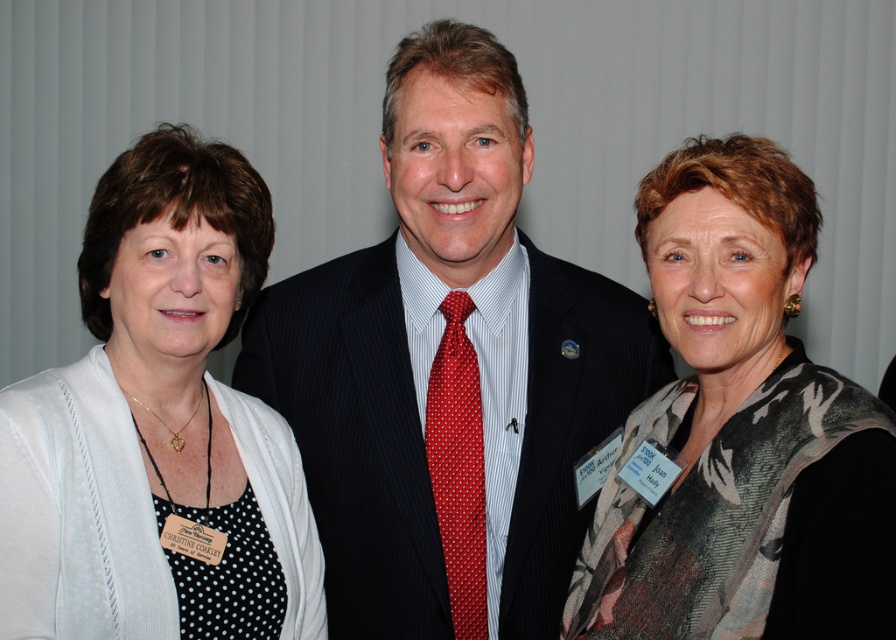
The height and width of the screenshot is (640, 896). What do you see at coordinates (157, 426) in the screenshot?
I see `white knit cardigan at left` at bounding box center [157, 426].

Which is in front, point (299, 536) or point (468, 497)?

Point (299, 536) is in front.

Between point (177, 285) and point (459, 568), which one is positioned in front?

Positioned in front is point (177, 285).

Locate an element on the screen. This screenshot has height=640, width=896. white knit cardigan at left is located at coordinates (157, 426).

Which is above, white knit cardigan at left or floral scarf at center?

white knit cardigan at left is higher up.

Who is more distant from viewer, (274, 502) or (691, 275)?

The point (274, 502) is more distant.

Where is `white knit cardigan at left`? white knit cardigan at left is located at coordinates (157, 426).

Looking at this image, between dark blue suit at center and white knit cardigan at left, which one appears on the right side from the viewer's perspective?

dark blue suit at center is more to the right.

The image size is (896, 640). What do you see at coordinates (449, 369) in the screenshot?
I see `dark blue suit at center` at bounding box center [449, 369].

Measure the distance between point [481,564] and camera.

1.46 meters

Find the location of a particular element. This screenshot has height=640, width=896. dark blue suit at center is located at coordinates (449, 369).